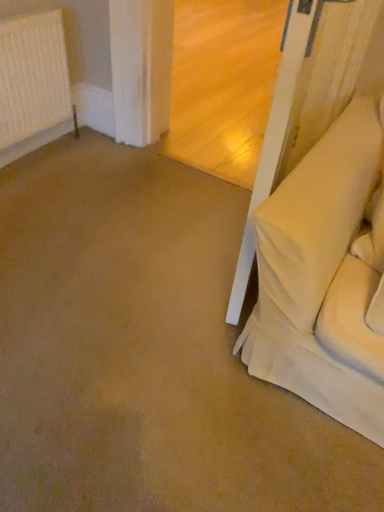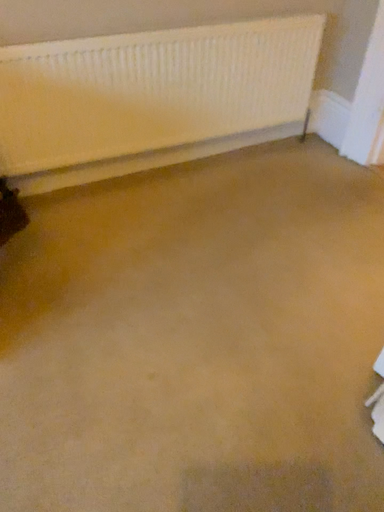
Question: Which way did the camera rotate in the video?

Choices:
 (A) rotated right
 (B) rotated left

Answer: (B)